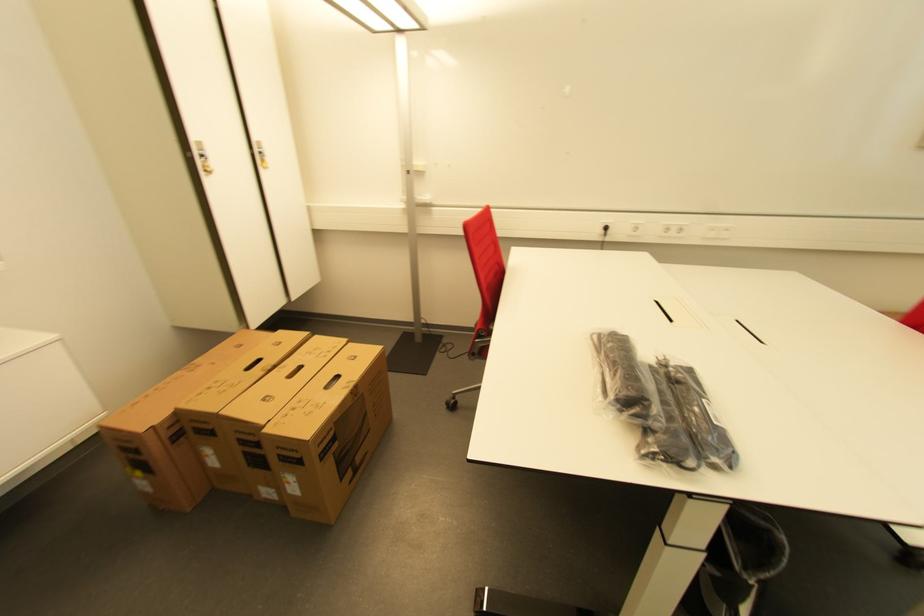
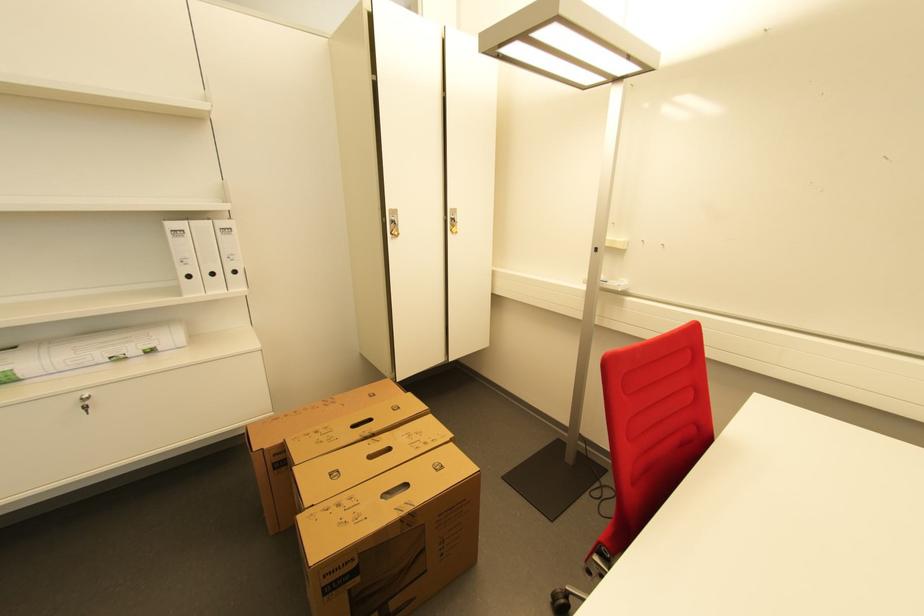
Question: The images are taken continuously from a first-person perspective. In which direction is your viewpoint rotating?

Choices:
 (A) Left
 (B) Right
 (C) Up
 (D) Down

Answer: (A)